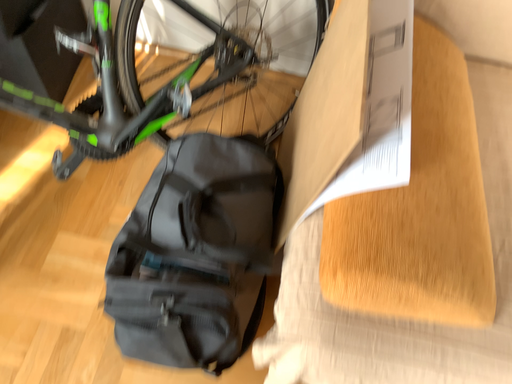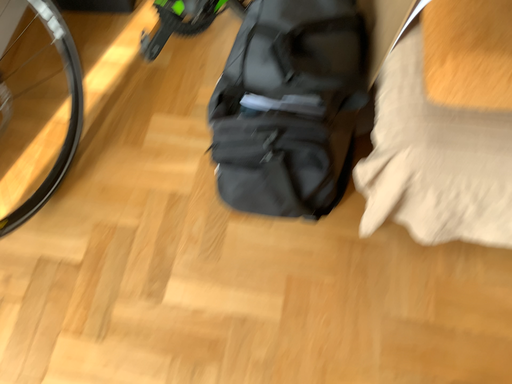
Question: How did the camera likely rotate when shooting the video?

Choices:
 (A) rotated right
 (B) rotated left

Answer: (B)